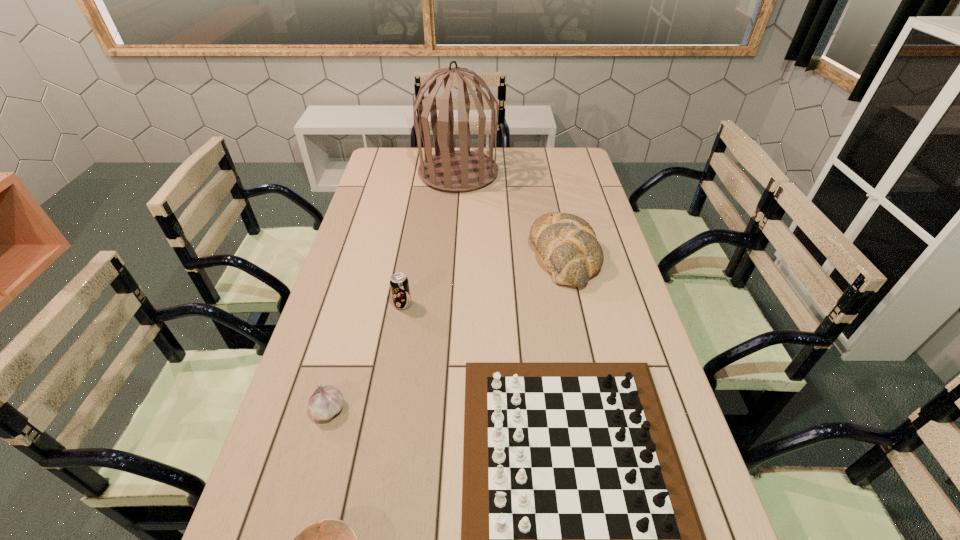
Where is `object present at the left edge`? The height and width of the screenshot is (540, 960). object present at the left edge is located at coordinates (325, 402).

Image resolution: width=960 pixels, height=540 pixels. I want to click on object present at the right edge, so click(567, 246).

Image resolution: width=960 pixels, height=540 pixels. In the image, there is a desktop. What are the coordinates of `blank space at the left edge` in the screenshot? It's located at (363, 304).

This screenshot has height=540, width=960. Identify the location of vacant area at the far left corner of the desktop. (392, 154).

Find the location of `vacant space at the far right corner of the desktop`. vacant space at the far right corner of the desktop is located at coordinates (567, 163).

The width and height of the screenshot is (960, 540). I want to click on free space between the tallest object and the fifth nearest object, so click(511, 214).

Find the location of a particular element. empty location between the bread and the farthest object is located at coordinates (511, 214).

Locate an element on the screen. The width and height of the screenshot is (960, 540). object that is the second closest to the second farthest object is located at coordinates (580, 539).

Identify which object is the third nearest to the birdcage. Please provide its 2D coordinates. Your answer should be formatted as a tuple, i.e. [(x, y)], where the tuple contains the x and y coordinates of a point satisfying the conditions above.

[(580, 539)]

Locate an element on the screen. The height and width of the screenshot is (540, 960). vacant position in the image that satisfies the following two spatial constraints: 1. on the back side of the garlic; 2. on the left side of the third farthest object is located at coordinates (358, 305).